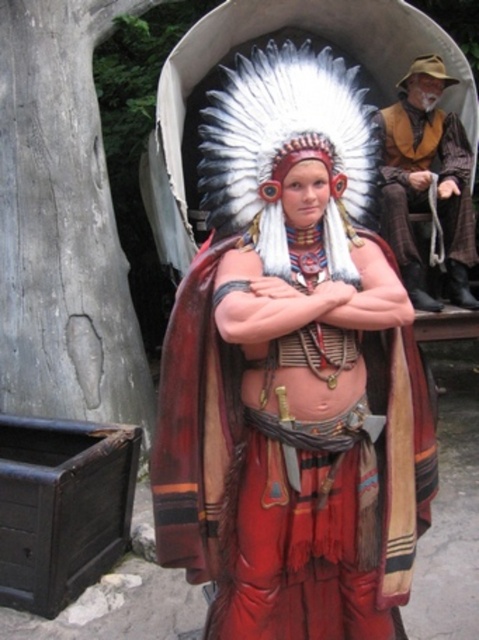
Between point (190, 422) and point (417, 259), which one is positioned behind?

Point (417, 259)

Between point (423, 432) and point (442, 216), which one is positioned in front?

Point (423, 432) is more forward.

Does point (298, 230) lie behind point (418, 115)?

No, it is in front of (418, 115).

Identify the location of matte red fabric at center. (293, 369).